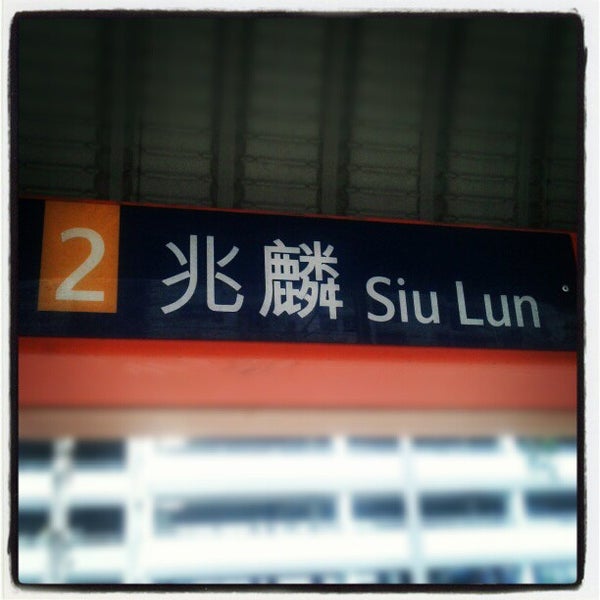
Identify the location of glass window. The width and height of the screenshot is (600, 600). (38, 549), (553, 552).